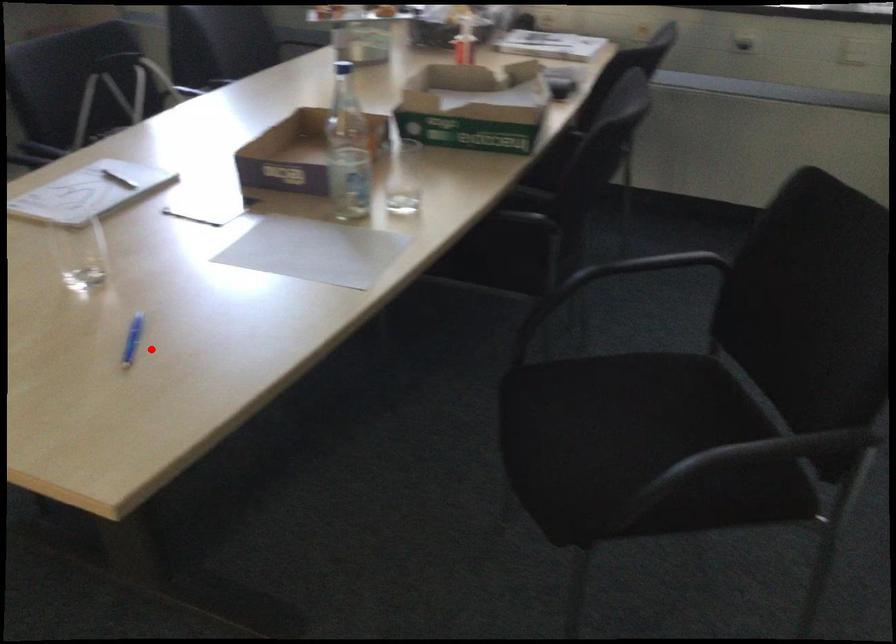
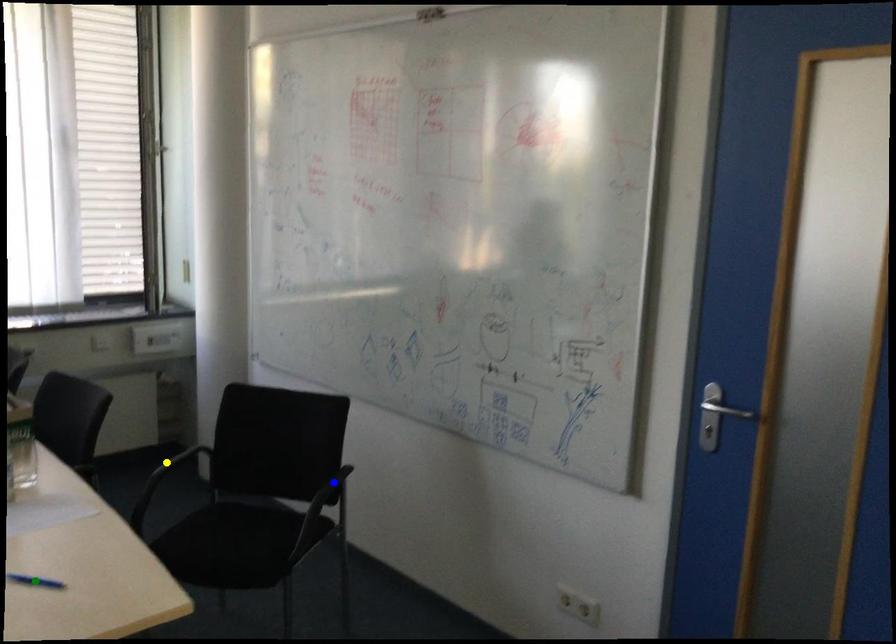
Question: I am providing you with two images of the same scene from different viewpoints. A red point is marked on the first image. You are given multiple points on the second image. Which mark in image 2 goes with the point in image 1?

Choices:
 (A) blue point
 (B) yellow point
 (C) green point

Answer: (C)